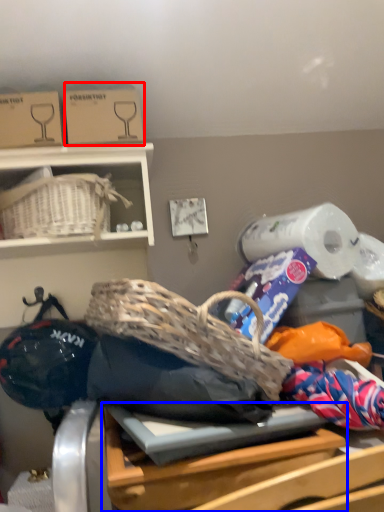
Question: Which object appears farthest to the camera in this image, cardboard box (highlighted by a red box) or table (highlighted by a blue box)?

Choices:
 (A) cardboard box
 (B) table

Answer: (A)